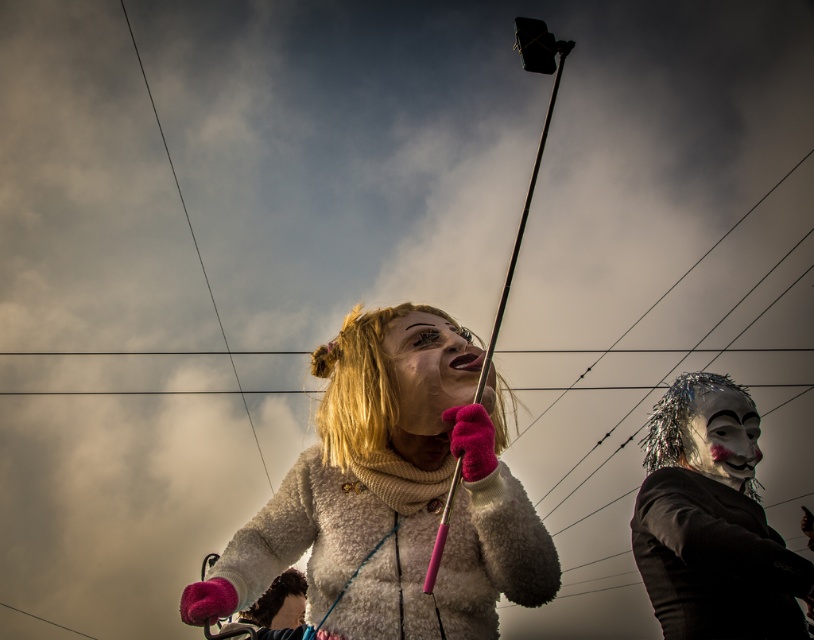
Who is more forward, (694, 385) or (710, 477)?

Point (710, 477)

From the picture: Does shiny silver mask at center come behind silvery metallic mask at upper right?

No, it is in front of silvery metallic mask at upper right.

The height and width of the screenshot is (640, 814). What do you see at coordinates (711, 522) in the screenshot?
I see `shiny silver mask at center` at bounding box center [711, 522].

This screenshot has height=640, width=814. I want to click on shiny silver mask at center, so (711, 522).

Who is positioned more to the left, fluffy white coat at center or shiny silver mask at center?

From the viewer's perspective, fluffy white coat at center appears more on the left side.

Between point (362, 433) and point (758, 422), which one is positioned in front?

Point (362, 433) is more forward.

You are a GUI agent. You are given a task and a screenshot of the screen. Output one action in this format:
    pyautogui.click(x=<x>, y=<y>)
    Task: Click on the fluffy white coat at center
    The image size is (814, 640).
    Given the screenshot: What is the action you would take?
    pyautogui.click(x=392, y=493)

Locate an element on the screen. Image resolution: width=814 pixels, height=640 pixels. shiny silver mask at center is located at coordinates (711, 522).

Does point (736, 410) lie in front of point (462, 400)?

No, (736, 410) is further to viewer.

Image resolution: width=814 pixels, height=640 pixels. Find the location of `shiny silver mask at center`. shiny silver mask at center is located at coordinates (711, 522).